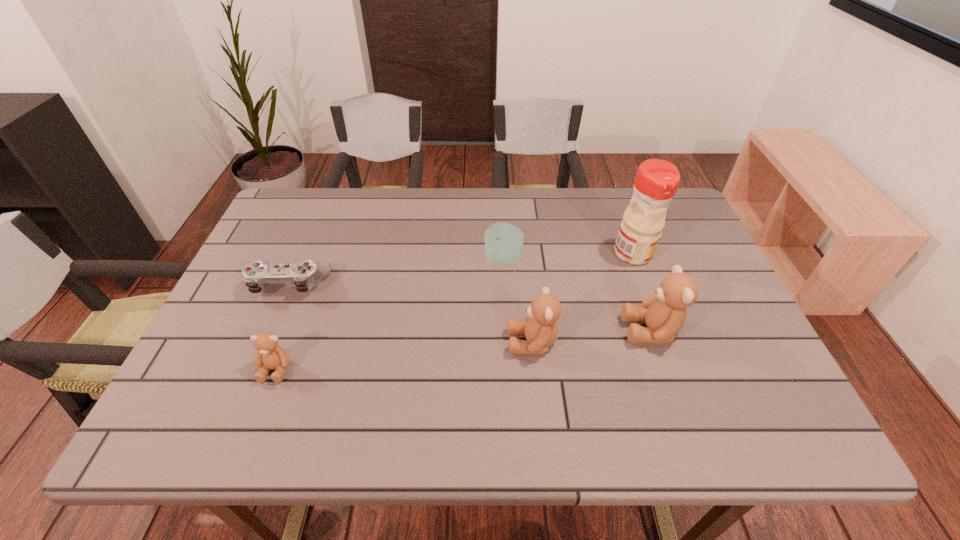
You are a GUI agent. You are given a task and a screenshot of the screen. Output one action in this format:
    pyautogui.click(x=<x>, y=<y>)
    Task: Click on the leftmost teddy bear
    
    Given the screenshot: What is the action you would take?
    pyautogui.click(x=270, y=355)

The height and width of the screenshot is (540, 960). I want to click on the third tallest object, so click(x=540, y=329).

At what (x,y) coordinates should I click in order to perform the action: click on the second shortest teddy bear. Please return your answer as a coordinate pair (x, y). The width and height of the screenshot is (960, 540). Looking at the image, I should click on (540, 329).

This screenshot has height=540, width=960. What are the coordinates of `the rightmost teddy bear` in the screenshot? It's located at (664, 312).

Where is `condiment`? Image resolution: width=960 pixels, height=540 pixels. condiment is located at coordinates (656, 182).

You are a GUI agent. You are given a task and a screenshot of the screen. Output one action in this format:
    pyautogui.click(x=<x>, y=<y>)
    Task: Click on the apple
    
    Given the screenshot: What is the action you would take?
    pyautogui.click(x=503, y=242)

The image size is (960, 540). Find the location of `control`. control is located at coordinates (304, 274).

The image size is (960, 540). What are the coordinates of `vacant space located on the front-facing side of the fourth shortest object` in the screenshot? It's located at (468, 342).

This screenshot has width=960, height=540. In order to click on vacant space located 0.080m on the front-facing side of the fourth shortest object in this screenshot , I will do `click(473, 342)`.

Where is `vacant space located on the front-facing side of the fourth shortest object`? vacant space located on the front-facing side of the fourth shortest object is located at coordinates (381, 342).